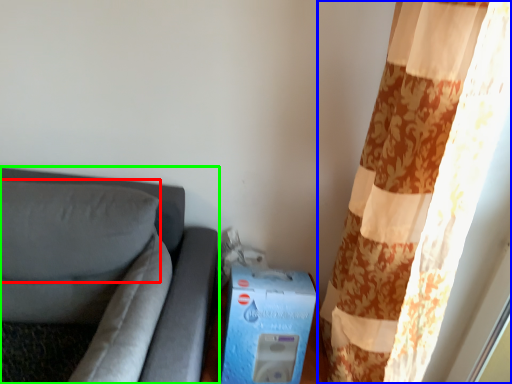
Question: Based on their relative distances, which object is farther from pillow (highlighted by a red box)? Choose from curtain (highlighted by a blue box) and furniture (highlighted by a green box).

Choices:
 (A) curtain
 (B) furniture

Answer: (A)